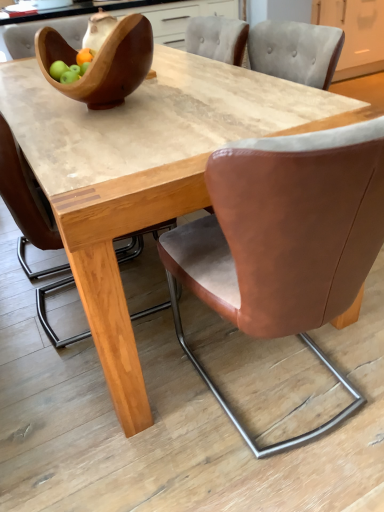
Question: From a real-world perspective, relative to brown leather chair at center, which appears as the 1th chair when viewed from the left, is matte gray cabinet at upper right vertically above or below?

Choices:
 (A) above
 (B) below

Answer: (B)

Question: Is matte gray cabinet at upper right taller or shorter than brown leather chair at center, which appears as the 1th chair when viewed from the left?

Choices:
 (A) short
 (B) tall

Answer: (A)

Question: Which of these objects is positioned closest to the brown leather chair at center, which appears as the 1th chair when viewed from the left?

Choices:
 (A) brown leather chair at lower right
 (B) matte gray cabinet at upper right
 (C) brown leather chair at center, the first chair viewed from the right
 (D) wooden bowl at upper left

Answer: (D)

Question: Which of these objects is positioned closest to the brown leather chair at center, which appears as the 1th chair when viewed from the left?

Choices:
 (A) matte gray cabinet at upper right
 (B) brown leather chair at lower right
 (C) brown leather chair at center, which ranks as the second chair in left-to-right order
 (D) wooden bowl at upper left

Answer: (D)